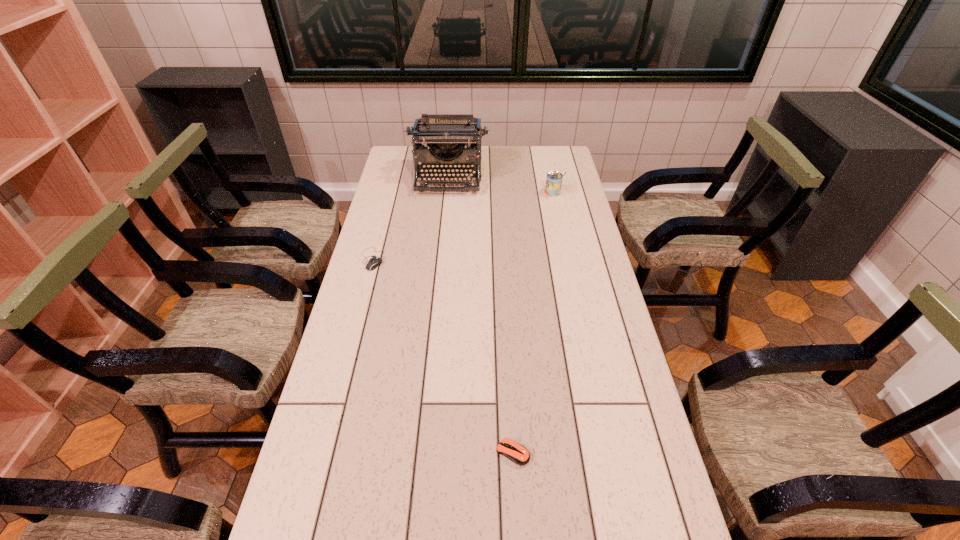
At what (x,y) coordinates should I click in order to perform the action: click on vacant space that's between the nearest object and the can. Please return your answer as a coordinate pair (x, y). Looking at the image, I should click on (534, 322).

The image size is (960, 540). Identify the location of free area in between the right computer mouse and the typewriter. (481, 315).

Find the location of `free space between the nearest object and the rightmost object`. free space between the nearest object and the rightmost object is located at coordinates (534, 322).

You are a GUI agent. You are given a task and a screenshot of the screen. Output one action in this format:
    pyautogui.click(x=<x>, y=<y>)
    Task: Click on the free spot between the rightmost object and the tallest object
    The image size is (960, 540).
    Given the screenshot: What is the action you would take?
    pyautogui.click(x=501, y=185)

Locate an element on the screen. empty location between the third shortest object and the leftmost object is located at coordinates (464, 226).

Locate an element on the screen. free space between the tallest object and the right computer mouse is located at coordinates (481, 315).

This screenshot has height=540, width=960. In order to click on vacant point located between the tallest object and the left computer mouse in this screenshot , I will do `click(411, 218)`.

Identify the location of unoccupied position between the left computer mouse and the can. (464, 226).

Identify the location of vacant point located between the leftmost object and the typewriter. This screenshot has width=960, height=540. (411, 218).

The height and width of the screenshot is (540, 960). In order to click on empty space between the can and the farther computer mouse in this screenshot , I will do `click(464, 226)`.